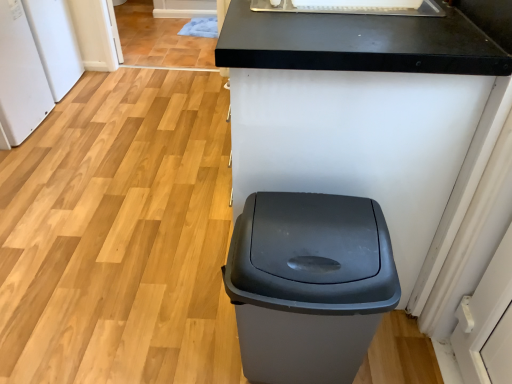
At what (x,y) coordinates should I click in order to perform the action: click on free location to the left of matte gray plastic trash can at center. Please return your answer as a coordinate pair (x, y). This screenshot has width=512, height=384. Looking at the image, I should click on (191, 335).